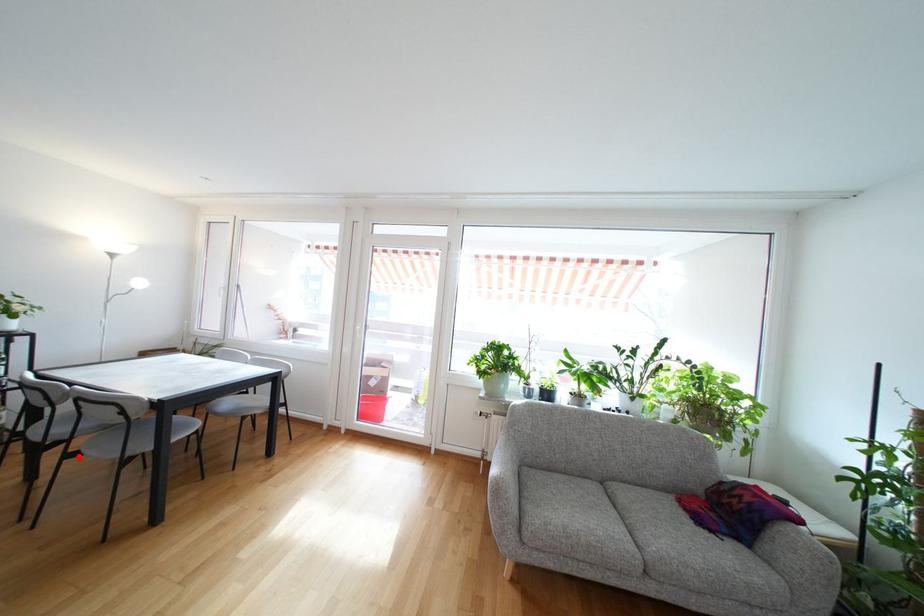
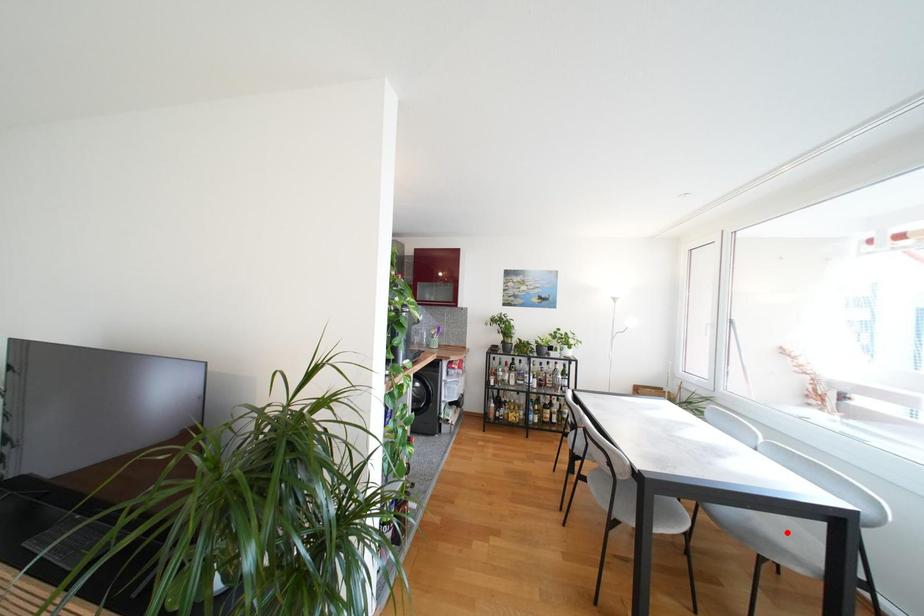
I am providing you with two images of the same scene from different viewpoints. A red point is marked on the first image and another point is marked on the second image. Are the points marked in image1 and image2 representing the same 3D position?

No